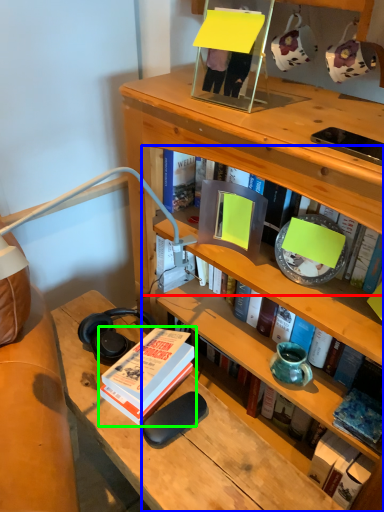
Question: Considering the real-world distances, which object is closest to book (highlighted by a red box)? book (highlighted by a blue box) or book (highlighted by a green box).

Choices:
 (A) book
 (B) book

Answer: (A)